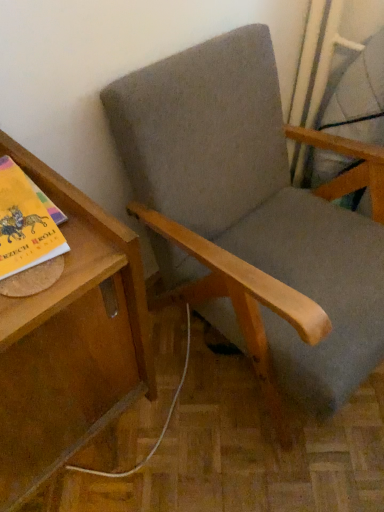
Question: Considering the relative sizes of wooden table at left and matte gray swivel chair at upper right in the image provided, is wooden table at left wider than matte gray swivel chair at upper right?

Choices:
 (A) no
 (B) yes

Answer: (B)

Question: Can you confirm if wooden table at left is bigger than matte gray swivel chair at upper right?

Choices:
 (A) no
 (B) yes

Answer: (B)

Question: Is wooden table at left thinner than matte gray swivel chair at upper right?

Choices:
 (A) no
 (B) yes

Answer: (A)

Question: From a real-world perspective, is wooden table at left located beneath matte gray swivel chair at upper right?

Choices:
 (A) no
 (B) yes

Answer: (B)

Question: From the image's perspective, is wooden table at left below matte gray swivel chair at upper right?

Choices:
 (A) no
 (B) yes

Answer: (B)

Question: In terms of width, does textured gray fabric chair at center look wider or thinner when compared to wooden table at left?

Choices:
 (A) wide
 (B) thin

Answer: (A)

Question: Relative to wooden table at left, is textured gray fabric chair at center in front or behind?

Choices:
 (A) behind
 (B) front

Answer: (A)

Question: Does point (249, 208) appear closer or farther from the camera than point (29, 368)?

Choices:
 (A) farther
 (B) closer

Answer: (A)

Question: From their relative heights in the image, would you say textured gray fabric chair at center is taller or shorter than wooden table at left?

Choices:
 (A) short
 (B) tall

Answer: (B)

Question: In the image, is textured gray fabric chair at center positioned in front of or behind matte gray swivel chair at upper right?

Choices:
 (A) front
 (B) behind

Answer: (A)

Question: Considering the positions of textured gray fabric chair at center and matte gray swivel chair at upper right in the image, is textured gray fabric chair at center bigger or smaller than matte gray swivel chair at upper right?

Choices:
 (A) small
 (B) big

Answer: (B)

Question: From a real-world perspective, is textured gray fabric chair at center physically located above or below matte gray swivel chair at upper right?

Choices:
 (A) above
 (B) below

Answer: (B)

Question: From the image's perspective, relative to matte gray swivel chair at upper right, is textured gray fabric chair at center above or below?

Choices:
 (A) above
 (B) below

Answer: (B)

Question: Considering their positions, is wooden table at left located in front of or behind textured gray fabric chair at center?

Choices:
 (A) front
 (B) behind

Answer: (A)

Question: Is wooden table at left taller or shorter than textured gray fabric chair at center?

Choices:
 (A) tall
 (B) short

Answer: (B)